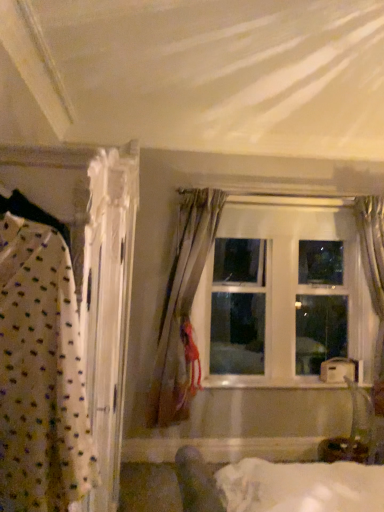
The height and width of the screenshot is (512, 384). I want to click on clear glass window at center, so click(x=284, y=296).

Is clear glass window at center positioned beyond the bounds of silky beige curtain at center, the second curtain in the right-to-left sequence?

Yes.

From the image's perspective, is clear glass window at center positioned above or below silky beige curtain at center, the second curtain in the right-to-left sequence?

From the image's perspective, clear glass window at center appears above silky beige curtain at center, the second curtain in the right-to-left sequence.

Is clear glass window at center thinner than silky beige curtain at center, which is the 1th curtain in left-to-right order?

Indeed, clear glass window at center has a lesser width compared to silky beige curtain at center, which is the 1th curtain in left-to-right order.

Does satin gray curtain at right, which ranks as the second curtain in left-to-right order, have a smaller size compared to clear glass window at center?

Yes.

What's the angular difference between satin gray curtain at right, positioned as the first curtain in right-to-left order, and clear glass window at center's facing directions?

The angle between the facing direction of satin gray curtain at right, positioned as the first curtain in right-to-left order, and the facing direction of clear glass window at center is 3.02 degrees.

Considering the points (367, 254) and (223, 246), which point is in front, point (367, 254) or point (223, 246)?

The point (367, 254) is closer to the camera.

Considering the relative sizes of satin gray curtain at right, positioned as the first curtain in right-to-left order, and clear glass window at center in the image provided, is satin gray curtain at right, positioned as the first curtain in right-to-left order, taller than clear glass window at center?

Indeed, satin gray curtain at right, positioned as the first curtain in right-to-left order, has a greater height compared to clear glass window at center.

From the image's perspective, relative to clear glass window at center, is silky beige curtain at center, which is the 1th curtain in left-to-right order, above or below?

silky beige curtain at center, which is the 1th curtain in left-to-right order, is below clear glass window at center.

Is point (167, 421) in front of point (278, 286)?

Yes, it is.

Which of these two, silky beige curtain at center, which is the 1th curtain in left-to-right order, or clear glass window at center, stands taller?

Standing taller between the two is silky beige curtain at center, which is the 1th curtain in left-to-right order.

In the image, is silky beige curtain at center, which is the 1th curtain in left-to-right order, on the left side or the right side of clear glass window at center?

Clearly, silky beige curtain at center, which is the 1th curtain in left-to-right order, is on the left of clear glass window at center in the image.

Consider the image. Does satin gray curtain at right, which ranks as the second curtain in left-to-right order, have a larger size compared to white glossy wood at center?

Correct, satin gray curtain at right, which ranks as the second curtain in left-to-right order, is larger in size than white glossy wood at center.

Looking at this image, measure the distance between satin gray curtain at right, positioned as the first curtain in right-to-left order, and white glossy wood at center.

satin gray curtain at right, positioned as the first curtain in right-to-left order, is 3.54 feet from white glossy wood at center.

Is satin gray curtain at right, which ranks as the second curtain in left-to-right order, taller or shorter than white glossy wood at center?

satin gray curtain at right, which ranks as the second curtain in left-to-right order, is taller than white glossy wood at center.

Could you tell me if satin gray curtain at right, which ranks as the second curtain in left-to-right order, is turned towards white glossy wood at center?

No, satin gray curtain at right, which ranks as the second curtain in left-to-right order, is not oriented towards white glossy wood at center.

Based on the photo, is the depth of clear glass window at center greater than that of satin gray curtain at right, which ranks as the second curtain in left-to-right order?

Yes, clear glass window at center is behind satin gray curtain at right, which ranks as the second curtain in left-to-right order.

From the image's perspective, between clear glass window at center and satin gray curtain at right, which ranks as the second curtain in left-to-right order, who is located below?

satin gray curtain at right, which ranks as the second curtain in left-to-right order, appears lower in the image.

Can you confirm if clear glass window at center is smaller than satin gray curtain at right, positioned as the first curtain in right-to-left order?

Incorrect, clear glass window at center is not smaller in size than satin gray curtain at right, positioned as the first curtain in right-to-left order.

Is white glossy wood at center bigger or smaller than clear glass window at center?

white glossy wood at center is smaller than clear glass window at center.

Considering the relative sizes of white glossy wood at center and clear glass window at center in the image provided, is white glossy wood at center thinner than clear glass window at center?

Indeed, white glossy wood at center has a lesser width compared to clear glass window at center.

From a real-world perspective, is white glossy wood at center physically below clear glass window at center?

Yes.

Is satin gray curtain at right, positioned as the first curtain in right-to-left order, not within silky beige curtain at center, the second curtain in the right-to-left sequence?

Absolutely, satin gray curtain at right, positioned as the first curtain in right-to-left order, is external to silky beige curtain at center, the second curtain in the right-to-left sequence.

Considering the sizes of objects satin gray curtain at right, which ranks as the second curtain in left-to-right order, and silky beige curtain at center, which is the 1th curtain in left-to-right order, in the image provided, who is taller, satin gray curtain at right, which ranks as the second curtain in left-to-right order, or silky beige curtain at center, which is the 1th curtain in left-to-right order,?

Standing taller between the two is satin gray curtain at right, which ranks as the second curtain in left-to-right order.

This screenshot has width=384, height=512. Identify the location of curtain located on the left of satin gray curtain at right, positioned as the first curtain in right-to-left order. (183, 309).

From a real-world perspective, which is physically above, satin gray curtain at right, positioned as the first curtain in right-to-left order, or silky beige curtain at center, which is the 1th curtain in left-to-right order?

From a 3D spatial view, satin gray curtain at right, positioned as the first curtain in right-to-left order, is above.

Where is `window positioned vertically above the silky beige curtain at center, the second curtain in the right-to-left sequence (from a real-world perspective)`? window positioned vertically above the silky beige curtain at center, the second curtain in the right-to-left sequence (from a real-world perspective) is located at coordinates (284, 296).

Where is `the 1st curtain located beneath the clear glass window at center (from a real-world perspective)`? Image resolution: width=384 pixels, height=512 pixels. the 1st curtain located beneath the clear glass window at center (from a real-world perspective) is located at coordinates (373, 265).

When comparing their distances from clear glass window at center, does silky beige curtain at center, which is the 1th curtain in left-to-right order, or satin gray curtain at right, which ranks as the second curtain in left-to-right order, seem further?

The object further to clear glass window at center is satin gray curtain at right, which ranks as the second curtain in left-to-right order.

From the image, which object appears to be farther from white glossy wood at center, clear glass window at center or silky beige curtain at center, which is the 1th curtain in left-to-right order?

silky beige curtain at center, which is the 1th curtain in left-to-right order, is positioned further to the anchor white glossy wood at center.

From the image, which object appears to be nearer to satin gray curtain at right, positioned as the first curtain in right-to-left order, clear glass window at center or white glossy wood at center?

clear glass window at center is positioned closer to the anchor satin gray curtain at right, positioned as the first curtain in right-to-left order.

Estimate the real-world distances between objects in this image. Which object is further from white glossy wood at center, silky beige curtain at center, the second curtain in the right-to-left sequence, or satin gray curtain at right, positioned as the first curtain in right-to-left order?

satin gray curtain at right, positioned as the first curtain in right-to-left order, is positioned further to the anchor white glossy wood at center.

Based on their spatial positions, is clear glass window at center or satin gray curtain at right, which ranks as the second curtain in left-to-right order, further from silky beige curtain at center, the second curtain in the right-to-left sequence?

Based on the image, satin gray curtain at right, which ranks as the second curtain in left-to-right order, appears to be further to silky beige curtain at center, the second curtain in the right-to-left sequence.

From the picture: Estimate the real-world distances between objects in this image. Which object is further from clear glass window at center, white glossy wood at center or silky beige curtain at center, the second curtain in the right-to-left sequence?

white glossy wood at center lies further to clear glass window at center than the other object.

Based on their spatial positions, is satin gray curtain at right, positioned as the first curtain in right-to-left order, or silky beige curtain at center, which is the 1th curtain in left-to-right order, further from white glossy wood at center?

Based on the image, satin gray curtain at right, positioned as the first curtain in right-to-left order, appears to be further to white glossy wood at center.

From the image, which object appears to be nearer to clear glass window at center, satin gray curtain at right, positioned as the first curtain in right-to-left order, or silky beige curtain at center, which is the 1th curtain in left-to-right order?

silky beige curtain at center, which is the 1th curtain in left-to-right order, lies closer to clear glass window at center than the other object.

Identify the location of window sill between silky beige curtain at center, which is the 1th curtain in left-to-right order, and satin gray curtain at right, positioned as the first curtain in right-to-left order. (267, 382).

Locate an element on the screen. The height and width of the screenshot is (512, 384). window situated between silky beige curtain at center, which is the 1th curtain in left-to-right order, and satin gray curtain at right, which ranks as the second curtain in left-to-right order, from left to right is located at coordinates (284, 296).

At what (x,y) coordinates should I click in order to perform the action: click on window sill between silky beige curtain at center, the second curtain in the right-to-left sequence, and clear glass window at center from left to right. Please return your answer as a coordinate pair (x, y). This screenshot has width=384, height=512. Looking at the image, I should click on (267, 382).